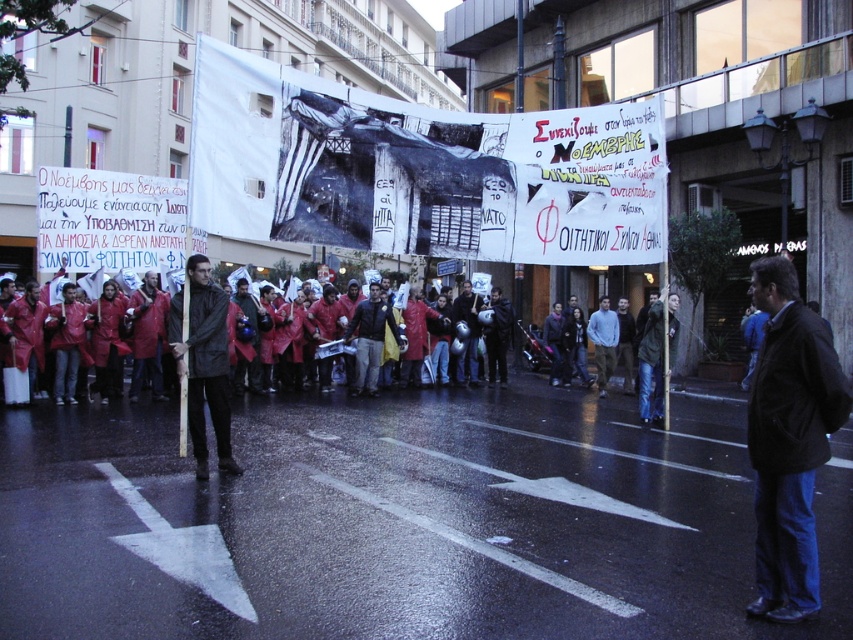
Between dark green fabric coat at center and metallic helmet at center, which one is positioned higher?

Positioned higher is metallic helmet at center.

Can you confirm if dark green fabric coat at center is wider than metallic helmet at center?

Correct, the width of dark green fabric coat at center exceeds that of metallic helmet at center.

Locate an element on the screen. dark green fabric coat at center is located at coordinates (204, 362).

Find the location of a particular element. This screenshot has width=853, height=640. dark green fabric coat at center is located at coordinates click(204, 362).

The width and height of the screenshot is (853, 640). Identify the location of black and white poster at center. (421, 170).

Is point (541, 172) positioned after point (465, 284)?

No.

Find the location of a particular element. black and white poster at center is located at coordinates (421, 170).

What do you see at coordinates (788, 440) in the screenshot?
I see `black leather jacket at lower right` at bounding box center [788, 440].

Can you confirm if black leather jacket at lower right is positioned to the left of dark green fabric coat at center?

No, black leather jacket at lower right is not to the left of dark green fabric coat at center.

The image size is (853, 640). What do you see at coordinates (788, 440) in the screenshot?
I see `black leather jacket at lower right` at bounding box center [788, 440].

This screenshot has height=640, width=853. I want to click on black leather jacket at lower right, so click(788, 440).